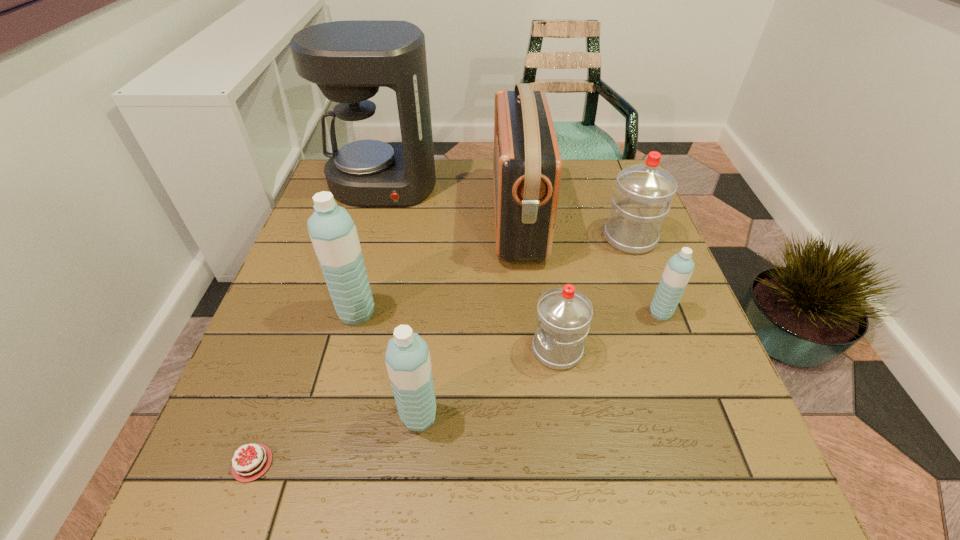
Identify which water bottle is the nearest to the radio receiver. Please provide its 2D coordinates. Your answer should be formatted as a tuple, i.e. [(x, y)], where the tuple contains the x and y coordinates of a point satisfying the conditions above.

[(643, 193)]

Locate which water bottle ranks fifth in proximity to the chocolate cake. Please provide its 2D coordinates. Your answer should be formatted as a tuple, i.e. [(x, y)], where the tuple contains the x and y coordinates of a point satisfying the conditions above.

[(643, 193)]

Identify which blue water bottle is the nearest to the fourth farthest water bottle. Please provide its 2D coordinates. Your answer should be formatted as a tuple, i.e. [(x, y)], where the tuple contains the x and y coordinates of a point satisfying the conditions above.

[(678, 270)]

At what (x,y) coordinates should I click in order to perform the action: click on blue water bottle that stands as the third closest to the tallest object. Please return your answer as a coordinate pair (x, y). This screenshot has height=540, width=960. Looking at the image, I should click on 678,270.

I want to click on free region that satisfies the following two spatial constraints: 1. on the button side of the tallest object; 2. on the left side of the second smallest blue water bottle, so click(x=320, y=416).

The width and height of the screenshot is (960, 540). What are the coordinates of `free space that satisfies the following two spatial constraints: 1. on the button side of the dark coffee maker; 2. on the right side of the leftmost water bottle` in the screenshot? It's located at (348, 313).

Locate an element on the screen. This screenshot has height=540, width=960. free spot that satisfies the following two spatial constraints: 1. on the handle side of the right white water bottle; 2. on the front-facing side of the radio receiver is located at coordinates (623, 219).

This screenshot has width=960, height=540. I want to click on blank space that satisfies the following two spatial constraints: 1. on the handle side of the right white water bottle; 2. on the front-facing side of the radio receiver, so click(623, 219).